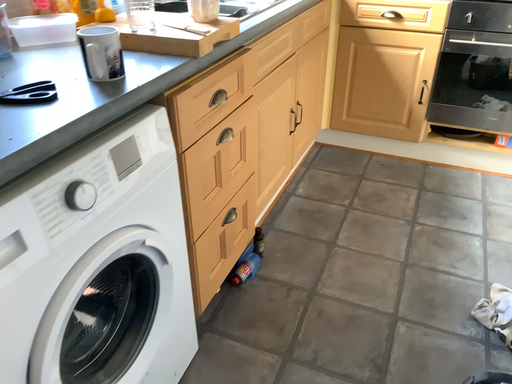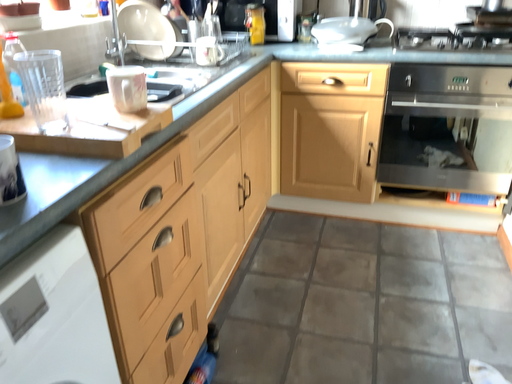
Question: How did the camera likely rotate when shooting the video?

Choices:
 (A) rotated downward
 (B) rotated upward

Answer: (B)